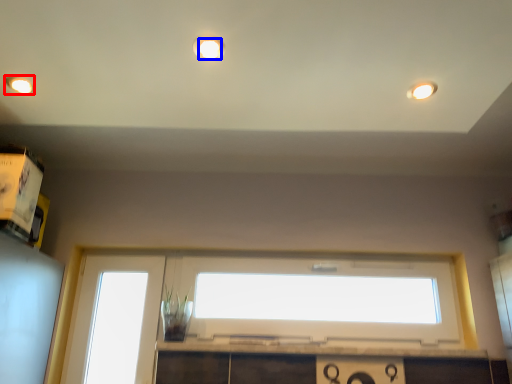
Question: Which point is closer to the camera, lighting (highlighted by a red box) or lighting (highlighted by a blue box)?

Choices:
 (A) lighting
 (B) lighting

Answer: (B)